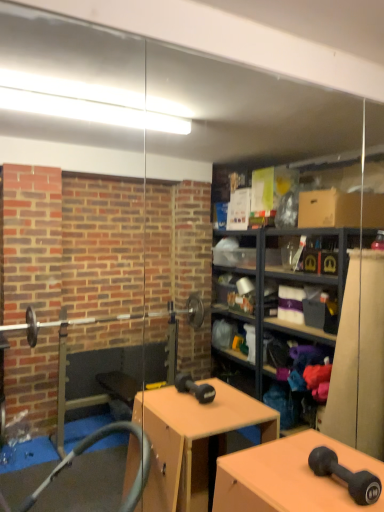
Locate an element on the screen. The width and height of the screenshot is (384, 512). blank space to the left of matte black dumbbell at lower right is located at coordinates (291, 485).